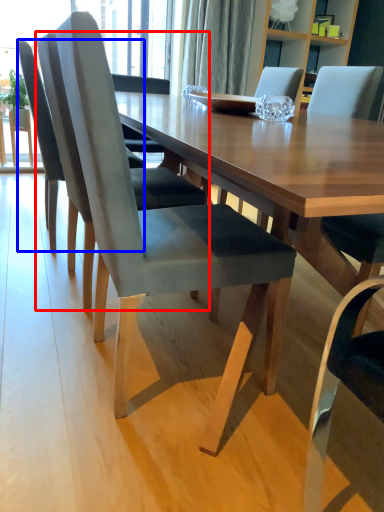
Question: Which object is further to the camera taking this photo, chair (highlighted by a red box) or chair (highlighted by a blue box)?

Choices:
 (A) chair
 (B) chair

Answer: (B)